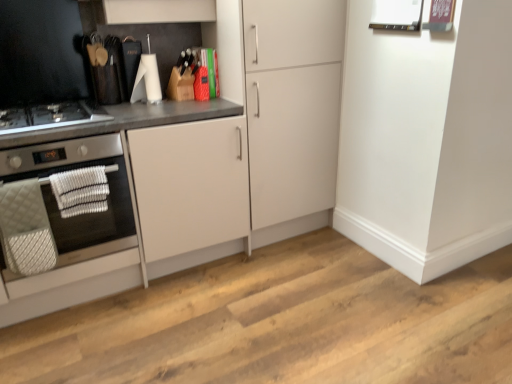
Question: Can we say white matte cabinet at left, positioned as the first cabinetry in left-to-right order, lies outside white matte cabinet at center, which is the first cabinetry from right to left?

Choices:
 (A) yes
 (B) no

Answer: (A)

Question: Is white matte cabinet at left, positioned as the first cabinetry in left-to-right order, oriented away from white matte cabinet at center, the second cabinetry positioned from the left?

Choices:
 (A) yes
 (B) no

Answer: (B)

Question: From a real-world perspective, is white matte cabinet at left, the 2th cabinetry when ordered from right to left, located higher than white matte cabinet at center, which is the first cabinetry from right to left?

Choices:
 (A) yes
 (B) no

Answer: (B)

Question: Is the position of white matte cabinet at left, positioned as the first cabinetry in left-to-right order, less distant than that of white matte cabinet at center, which is the first cabinetry from right to left?

Choices:
 (A) yes
 (B) no

Answer: (A)

Question: Is white matte cabinet at left, positioned as the first cabinetry in left-to-right order, behind white matte cabinet at center, the second cabinetry positioned from the left?

Choices:
 (A) no
 (B) yes

Answer: (A)

Question: Considering the relative positions of white matte cabinet at left, positioned as the first cabinetry in left-to-right order, and white matte cabinet at center, which is the first cabinetry from right to left, in the image provided, is white matte cabinet at left, positioned as the first cabinetry in left-to-right order, to the left of white matte cabinet at center, which is the first cabinetry from right to left, from the viewer's perspective?

Choices:
 (A) yes
 (B) no

Answer: (A)

Question: Is black glass gas stove at left closer to camera compared to silver metallic oven at left?

Choices:
 (A) no
 (B) yes

Answer: (A)

Question: Considering the relative sizes of black glass gas stove at left and silver metallic oven at left in the image provided, is black glass gas stove at left wider than silver metallic oven at left?

Choices:
 (A) no
 (B) yes

Answer: (A)

Question: Could you tell me if black glass gas stove at left is turned towards silver metallic oven at left?

Choices:
 (A) no
 (B) yes

Answer: (A)

Question: From a real-world perspective, is black glass gas stove at left under silver metallic oven at left?

Choices:
 (A) no
 (B) yes

Answer: (A)

Question: Would you say black glass gas stove at left is outside silver metallic oven at left?

Choices:
 (A) yes
 (B) no

Answer: (A)

Question: Considering the relative positions of black glass gas stove at left and silver metallic oven at left in the image provided, is black glass gas stove at left to the right of silver metallic oven at left from the viewer's perspective?

Choices:
 (A) yes
 (B) no

Answer: (A)

Question: From the image's perspective, is white matte cabinet at center, the second cabinetry positioned from the left, located above black glass gas stove at left?

Choices:
 (A) yes
 (B) no

Answer: (A)